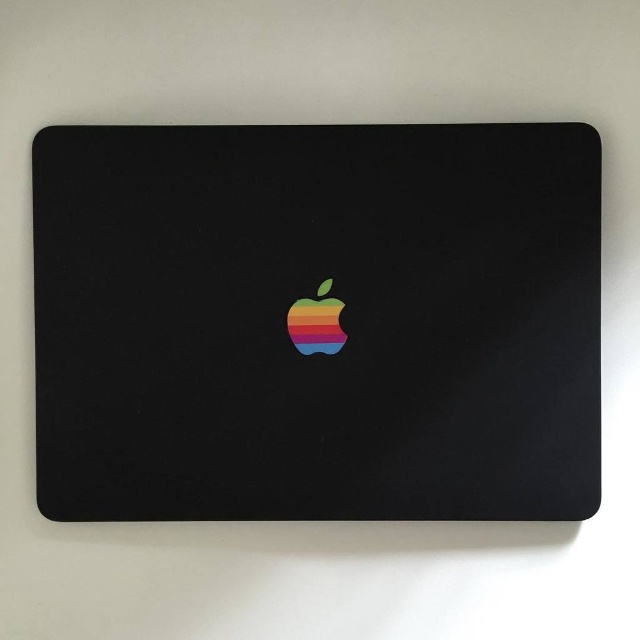
Which is in front, point (179, 188) or point (314, 321)?

Positioned in front is point (179, 188).

This screenshot has width=640, height=640. What do you see at coordinates (339, 321) in the screenshot?
I see `matte black laptop at center` at bounding box center [339, 321].

Is point (234, 284) in front of point (308, 332)?

Yes, point (234, 284) is in front of point (308, 332).

Find the location of a particular element. The height and width of the screenshot is (640, 640). matte black laptop at center is located at coordinates (339, 321).